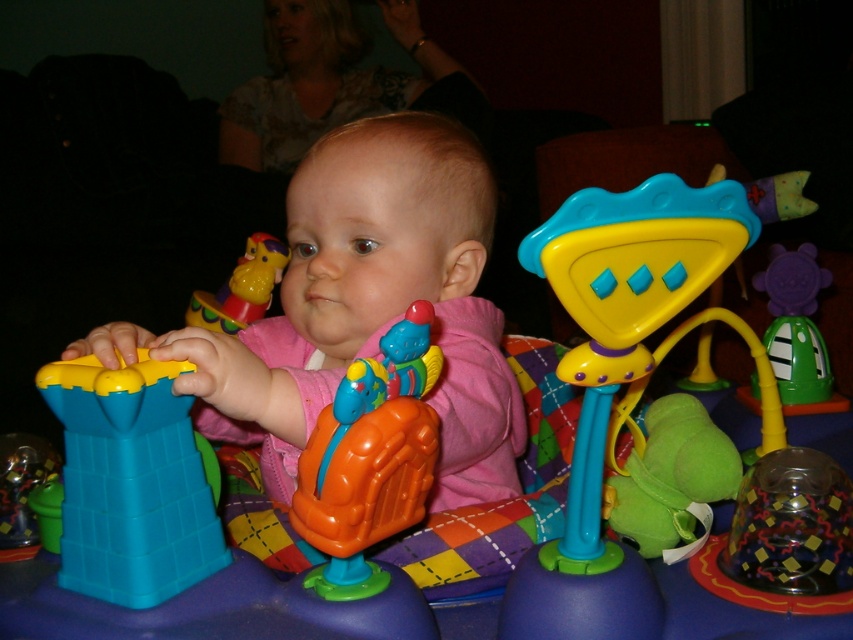
Is pink matte baby at center closer to camera compared to blue plastic tower at left?

No, it is behind blue plastic tower at left.

Who is more distant from viewer, (480,324) or (79,394)?

Point (480,324)

At what (x,y) coordinates should I click in order to perform the action: click on pink matte baby at center. Please return your answer as a coordinate pair (x, y). Image resolution: width=853 pixels, height=640 pixels. Looking at the image, I should click on (363, 307).

From the picture: Who is positioned more to the right, blue plastic tower at left or orange plastic toy at center?

orange plastic toy at center

Which is behind, point (167, 568) or point (396, 518)?

The point (167, 568) is more distant.

Image resolution: width=853 pixels, height=640 pixels. I want to click on blue plastic tower at left, so click(x=131, y=483).

The width and height of the screenshot is (853, 640). I want to click on blue plastic tower at left, so click(x=131, y=483).

Between point (671, 456) and point (809, 376), which one is positioned in front?

Point (671, 456) is more forward.

Measure the distance between point [680,486] and camera.

They are 27.35 inches apart.

Locate an element on the screen. green plush toy at center is located at coordinates click(674, 480).